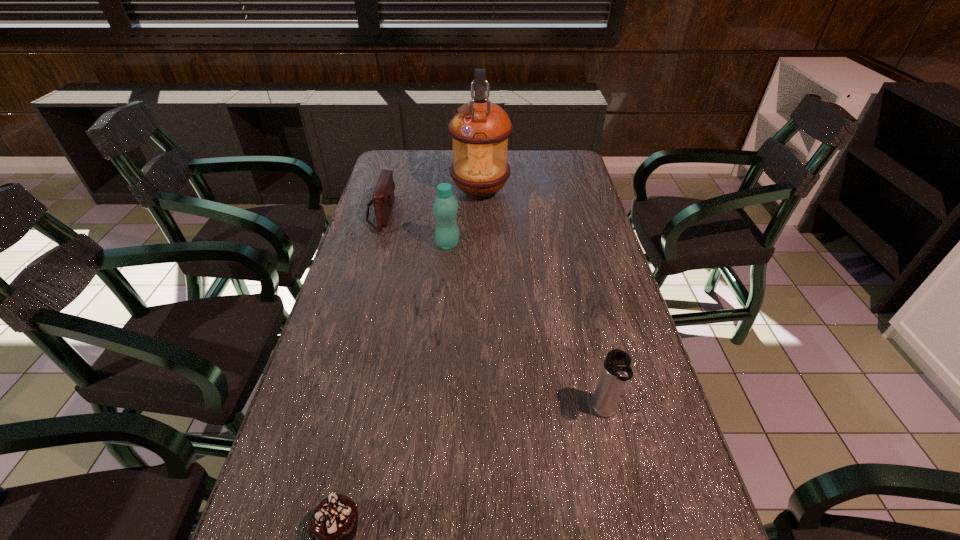
Locate an element on the screen. the tallest object is located at coordinates (479, 129).

Identify the location of the third farthest object. (445, 206).

Locate an element on the screen. the third shortest object is located at coordinates (616, 370).

Find the location of a particular element. This screenshot has height=540, width=960. the fourth farthest object is located at coordinates (616, 370).

The height and width of the screenshot is (540, 960). I want to click on shoulder bag, so click(x=383, y=198).

Find the location of a particular element. This screenshot has height=540, width=960. the fourth tallest object is located at coordinates (383, 198).

Where is `free location located on the right of the tallest object`? This screenshot has width=960, height=540. free location located on the right of the tallest object is located at coordinates (538, 192).

At what (x,y) coordinates should I click in order to perform the action: click on free space located 0.220m on the right of the bottle. Please return your answer as a coordinate pair (x, y). Looking at the image, I should click on (531, 245).

Find the location of a particular element. vacant space located on the handle side of the fourth farthest object is located at coordinates (618, 474).

The image size is (960, 540). What are the coordinates of `vacant region located 0.090m on the front flap of the shoulder bag` in the screenshot? It's located at (420, 213).